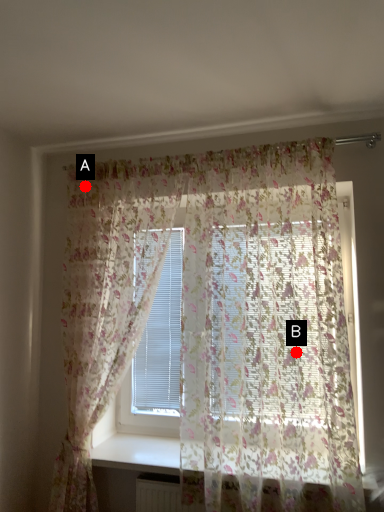
Question: Two points are circled on the image, labeled by A and B beside each circle. Which point is further to the camera?

Choices:
 (A) A is further
 (B) B is further

Answer: (A)